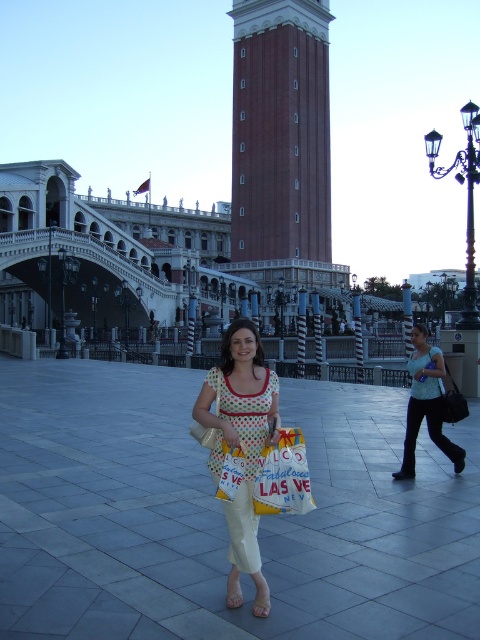
Question: Among these points, which one is nearest to the camera?

Choices:
 (A) (297, 493)
 (B) (312, 230)

Answer: (A)

Question: Which of the following is the farthest from the observer?

Choices:
 (A) (241, 404)
 (B) (434, 371)
 (C) (274, 106)
 (D) (271, 468)

Answer: (C)

Question: Which of the following is the farthest from the observer?

Choices:
 (A) (273, 496)
 (B) (264, 76)
 (C) (229, 516)
 (D) (433, 369)

Answer: (B)

Question: Is the position of polka dot fabric dress at center less distant than that of yellow fabric shopping bag at center?

Choices:
 (A) no
 (B) yes

Answer: (B)

Question: Can you confirm if red brick bell tower at center is positioned to the right of polka dot fabric dress at center?

Choices:
 (A) no
 (B) yes

Answer: (B)

Question: Can you confirm if polka dot fabric dress at center is positioned to the left of light blue fabric shirt at center?

Choices:
 (A) yes
 (B) no

Answer: (A)